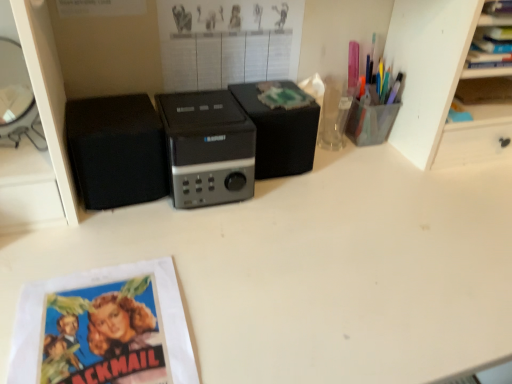
Identify the location of black matte speaker at center, arranged as the second speaker when viewed from the left. Image resolution: width=512 pixels, height=384 pixels. (280, 128).

What are the coordinates of `black plastic speaker at center` in the screenshot? It's located at (207, 148).

Identify the location of blue paper at lower left. (104, 328).

Does point (121, 121) appear closer or farther from the camera than point (167, 7)?

Point (121, 121).

From a real-world perspective, between black matte speaker at left, positioned as the 2th speaker in right-to-left order, and matte black poster at upper center, who is vertically higher?

matte black poster at upper center.

Is black matte speaker at left, which is the 1th speaker from left to right, far away from matte black poster at upper center?

No, black matte speaker at left, which is the 1th speaker from left to right, is not far from matte black poster at upper center.

Does matte black poster at upper center have a lesser height compared to black matte speaker at left, positioned as the 2th speaker in right-to-left order?

No, matte black poster at upper center is not shorter than black matte speaker at left, positioned as the 2th speaker in right-to-left order.

Consider the image. What's the angular difference between matte black poster at upper center and black matte speaker at left, positioned as the 2th speaker in right-to-left order,'s facing directions?

0.882 degrees separate the facing orientations of matte black poster at upper center and black matte speaker at left, positioned as the 2th speaker in right-to-left order.

Would you say matte black poster at upper center is inside or outside black matte speaker at left, positioned as the 2th speaker in right-to-left order?

matte black poster at upper center is outside black matte speaker at left, positioned as the 2th speaker in right-to-left order.

From the image's perspective, who appears lower, matte black poster at upper center or black matte speaker at left, which is the 1th speaker from left to right?

black matte speaker at left, which is the 1th speaker from left to right.

Based on their positions, is black matte speaker at center, the 1th speaker when ordered from right to left, located to the left or right of black plastic speaker at center?

black matte speaker at center, the 1th speaker when ordered from right to left, is positioned on black plastic speaker at center's right side.

How different are the orientations of black matte speaker at center, the 1th speaker when ordered from right to left, and black plastic speaker at center in degrees?

black matte speaker at center, the 1th speaker when ordered from right to left, and black plastic speaker at center are facing 1.43e-05 degrees away from each other.

Is black matte speaker at center, the 1th speaker when ordered from right to left, positioned far away from black plastic speaker at center?

They are positioned close to each other.

Based on the photo, which object is further away from the camera, black matte speaker at center, arranged as the second speaker when viewed from the left, or black plastic speaker at center?

black matte speaker at center, arranged as the second speaker when viewed from the left, is more distant.

What's the angular difference between blue paper at lower left and matte black poster at upper center's facing directions?

The facing directions of blue paper at lower left and matte black poster at upper center are 1.72 degrees apart.

How far apart are blue paper at lower left and matte black poster at upper center?

blue paper at lower left and matte black poster at upper center are 19.77 inches apart.

Does point (91, 369) appear closer or farther from the camera than point (209, 55)?

Point (91, 369) appears to be closer to the viewer than point (209, 55).

From the image's perspective, is blue paper at lower left above matte black poster at upper center?

No.

From the image's perspective, which object appears higher, matte black poster at upper center or black plastic speaker at center?

matte black poster at upper center appears higher in the image.

Relative to black plastic speaker at center, is matte black poster at upper center in front or behind?

matte black poster at upper center is positioned farther from the viewer than black plastic speaker at center.

Considering the sizes of matte black poster at upper center and black plastic speaker at center in the image, is matte black poster at upper center bigger or smaller than black plastic speaker at center?

matte black poster at upper center is smaller than black plastic speaker at center.

Considering the positions of point (193, 1) and point (205, 126), is point (193, 1) closer or farther from the camera than point (205, 126)?

Clearly, point (193, 1) is closer to the camera than point (205, 126).

Is blue paper at lower left inside translucent plastic pen holder at upper right?

Definitely not — blue paper at lower left is not inside translucent plastic pen holder at upper right.

Is translucent plastic pen holder at upper right next to blue paper at lower left and touching it?

They are not placed beside each other.

Is translucent plastic pen holder at upper right to the right of blue paper at lower left from the viewer's perspective?

Yes, translucent plastic pen holder at upper right is to the right of blue paper at lower left.

Consider the image. Is translucent plastic pen holder at upper right oriented away from blue paper at lower left?

translucent plastic pen holder at upper right is not turned away from blue paper at lower left.

In the scene shown: Is matte black poster at upper center oriented towards translucent plastic pen holder at upper right?

No, matte black poster at upper center is not facing towards translucent plastic pen holder at upper right.

From the image's perspective, is matte black poster at upper center positioned above or below translucent plastic pen holder at upper right?

Clearly, from the image's perspective, matte black poster at upper center is above translucent plastic pen holder at upper right.

What's the angular difference between matte black poster at upper center and translucent plastic pen holder at upper right's facing directions?

6.72 degrees.

In the image, is matte black poster at upper center positioned in front of or behind translucent plastic pen holder at upper right?

matte black poster at upper center is positioned closer to the viewer than translucent plastic pen holder at upper right.

In the image, there is a black matte speaker at left, positioned as the 2th speaker in right-to-left order. Identify the location of poster page above it (from the image's perspective). The width and height of the screenshot is (512, 384). (228, 41).

Where is `the 2nd speaker positioned below the matte black poster at upper center (from the image's perspective)`? The height and width of the screenshot is (384, 512). the 2nd speaker positioned below the matte black poster at upper center (from the image's perspective) is located at coordinates (116, 150).

Looking at the image, which one is located closer to translucent plastic pen holder at upper right, matte black poster at upper center or blue paper at lower left?

matte black poster at upper center is closer to translucent plastic pen holder at upper right.

Considering their positions, is black matte speaker at center, arranged as the second speaker when viewed from the left, positioned closer to black matte speaker at left, positioned as the 2th speaker in right-to-left order, than blue paper at lower left?

blue paper at lower left is positioned closer to the anchor black matte speaker at left, positioned as the 2th speaker in right-to-left order.

Looking at the image, which one is located further to black matte speaker at left, which is the 1th speaker from left to right, matte black poster at upper center or black matte speaker at center, the 1th speaker when ordered from right to left?

Based on the image, black matte speaker at center, the 1th speaker when ordered from right to left, appears to be further to black matte speaker at left, which is the 1th speaker from left to right.

Estimate the real-world distances between objects in this image. Which object is further from black matte speaker at left, which is the 1th speaker from left to right, matte black poster at upper center or blue paper at lower left?

blue paper at lower left.

In the scene shown: When comparing their distances from black matte speaker at center, the 1th speaker when ordered from right to left, does blue paper at lower left or matte black poster at upper center seem further?

blue paper at lower left is positioned further to the anchor black matte speaker at center, the 1th speaker when ordered from right to left.

Considering their positions, is black plastic speaker at center positioned further to blue paper at lower left than translucent plastic pen holder at upper right?

Among the two, translucent plastic pen holder at upper right is located further to blue paper at lower left.

Based on their spatial positions, is black matte speaker at left, which is the 1th speaker from left to right, or black matte speaker at center, arranged as the second speaker when viewed from the left, further from blue paper at lower left?

black matte speaker at center, arranged as the second speaker when viewed from the left, is positioned further to the anchor blue paper at lower left.

From the image, which object appears to be nearer to black matte speaker at left, which is the 1th speaker from left to right, blue paper at lower left or translucent plastic pen holder at upper right?

blue paper at lower left is closer to black matte speaker at left, which is the 1th speaker from left to right.

At what (x,y) coordinates should I click in order to perform the action: click on speaker between matte black poster at upper center and black plastic speaker at center in the up-down direction. Please return your answer as a coordinate pair (x, y). Looking at the image, I should click on (280, 128).

Find the location of a particular element. appliance positioned between blue paper at lower left and black matte speaker at center, arranged as the second speaker when viewed from the left, from near to far is located at coordinates (207, 148).

You are a GUI agent. You are given a task and a screenshot of the screen. Output one action in this format:
    pyautogui.click(x=<x>, y=<y>)
    Task: Click on the speaker between black plastic speaker at center and translucent plastic pen holder at upper right
    The height and width of the screenshot is (384, 512).
    Given the screenshot: What is the action you would take?
    280,128

Where is `poster page between black plastic speaker at center and translucent plastic pen holder at upper right`? The width and height of the screenshot is (512, 384). poster page between black plastic speaker at center and translucent plastic pen holder at upper right is located at coordinates (228, 41).